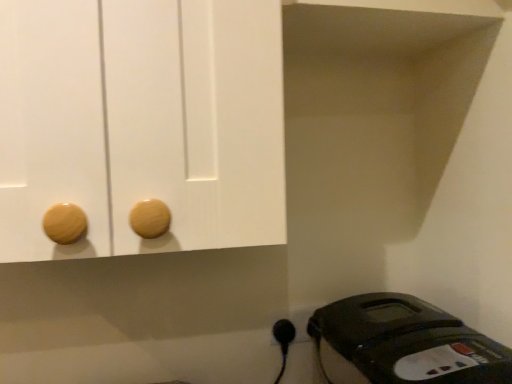
Question: Considering the positions of point (272, 314) and point (284, 337), is point (272, 314) closer or farther from the camera than point (284, 337)?

Choices:
 (A) farther
 (B) closer

Answer: (A)

Question: Considering the positions of black plastic outlet at lower right and black plastic plug at lower right in the image, is black plastic outlet at lower right wider or thinner than black plastic plug at lower right?

Choices:
 (A) wide
 (B) thin

Answer: (B)

Question: Estimate the real-world distances between objects in this image. Which object is farther from the black plastic plug at lower right?

Choices:
 (A) black plastic iron at lower right
 (B) black plastic outlet at lower right

Answer: (A)

Question: Which of these objects is positioned closest to the black plastic iron at lower right?

Choices:
 (A) black plastic outlet at lower right
 (B) black plastic plug at lower right

Answer: (A)